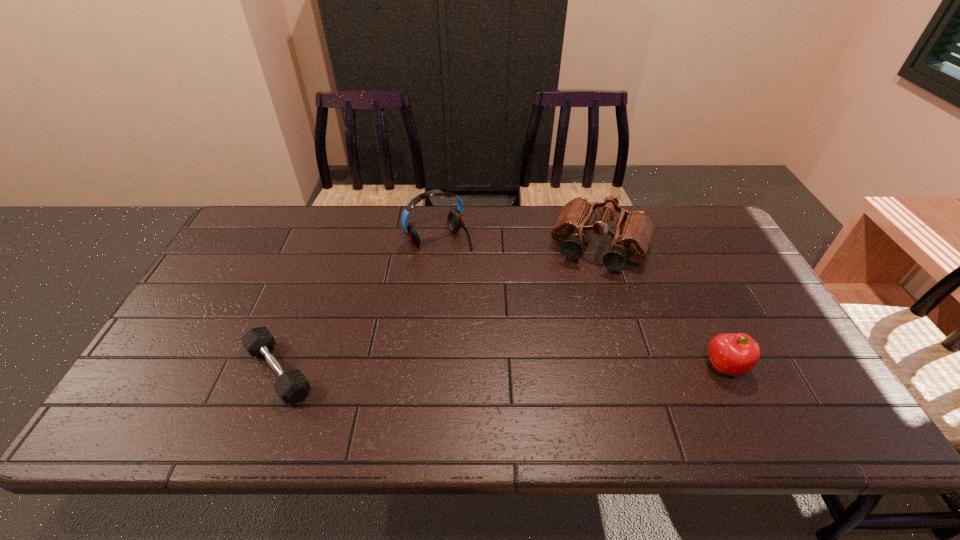
This screenshot has height=540, width=960. Identify the location of vacant space located with the microphone attached to the side of the headset. (501, 306).

Where is `vacant space located 0.070m through the eyepieces of the third shortest object`? The height and width of the screenshot is (540, 960). vacant space located 0.070m through the eyepieces of the third shortest object is located at coordinates (581, 292).

Locate an element on the screen. free location located through the eyepieces of the third shortest object is located at coordinates (558, 350).

Find the location of a particular element. The height and width of the screenshot is (540, 960). vacant point located through the eyepieces of the third shortest object is located at coordinates (560, 347).

The image size is (960, 540). I want to click on headset that is at the far edge, so click(x=455, y=216).

Where is `binoculars that is at the far edge`? This screenshot has height=540, width=960. binoculars that is at the far edge is located at coordinates (633, 233).

Where is `dumbbell that is at the near edge`? The width and height of the screenshot is (960, 540). dumbbell that is at the near edge is located at coordinates (292, 385).

The image size is (960, 540). Find the location of `apple positioned at the near edge`. apple positioned at the near edge is located at coordinates (734, 354).

Where is `object situated at the right edge`? Image resolution: width=960 pixels, height=540 pixels. object situated at the right edge is located at coordinates (734, 354).

At what (x,y) coordinates should I click in order to perform the action: click on object at the near right corner. Please return your answer as a coordinate pair (x, y). Looking at the image, I should click on (734, 354).